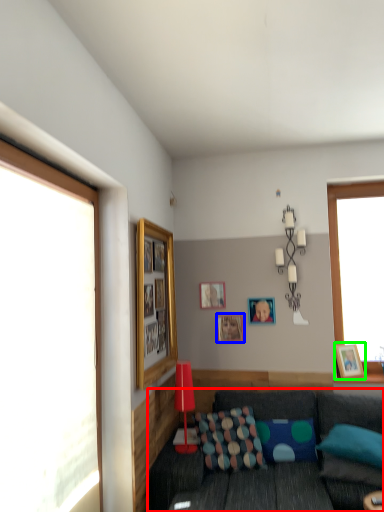
Question: Estimate the real-world distances between objects in this image. Which object is closer to studio couch (highlighted by a red box), picture frame (highlighted by a blue box) or picture frame (highlighted by a green box)?

Choices:
 (A) picture frame
 (B) picture frame

Answer: (B)